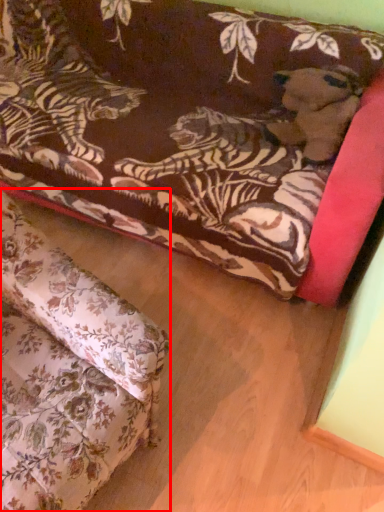
Question: In this image, where is studio couch (annotated by the red box) located relative to studio couch?

Choices:
 (A) right
 (B) left

Answer: (B)